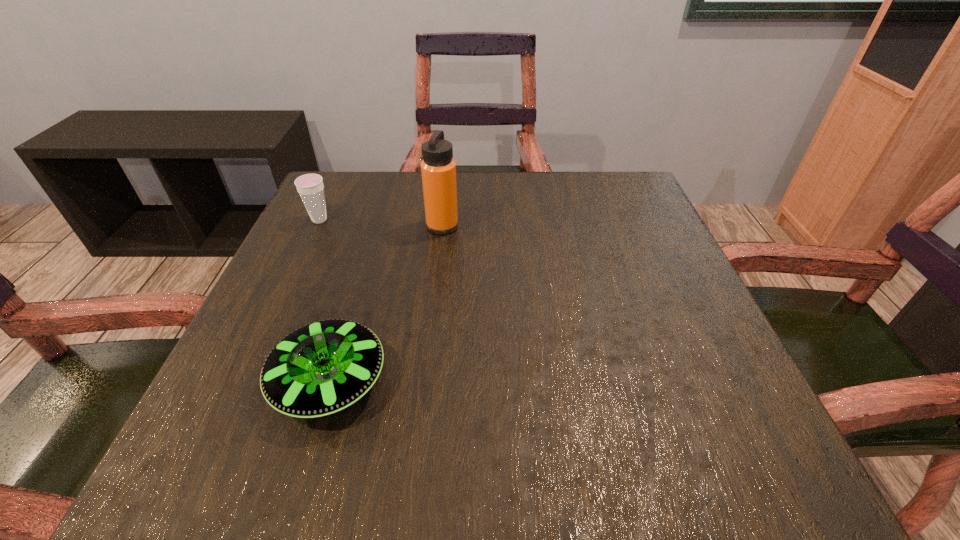
Identify the location of free point between the leftmost object and the tallest object. The height and width of the screenshot is (540, 960). (381, 223).

You are a GUI agent. You are given a task and a screenshot of the screen. Output one action in this format:
    pyautogui.click(x=<x>, y=<y>)
    Task: Click on the free space between the thermos bottle and the nearest object
    
    Given the screenshot: What is the action you would take?
    pyautogui.click(x=386, y=304)

Identify which object is the second closest to the rightmost object. Please provide its 2D coordinates. Your answer should be formatted as a tuple, i.e. [(x, y)], where the tuple contains the x and y coordinates of a point satisfying the conditions above.

[(324, 367)]

Locate an element on the screen. The height and width of the screenshot is (540, 960). object that stands as the closest to the saucer is located at coordinates (438, 168).

Where is `free space in the image that satisfies the following two spatial constraints: 1. on the front side of the saucer; 2. on the left side of the leftmost object`? free space in the image that satisfies the following two spatial constraints: 1. on the front side of the saucer; 2. on the left side of the leftmost object is located at coordinates (243, 382).